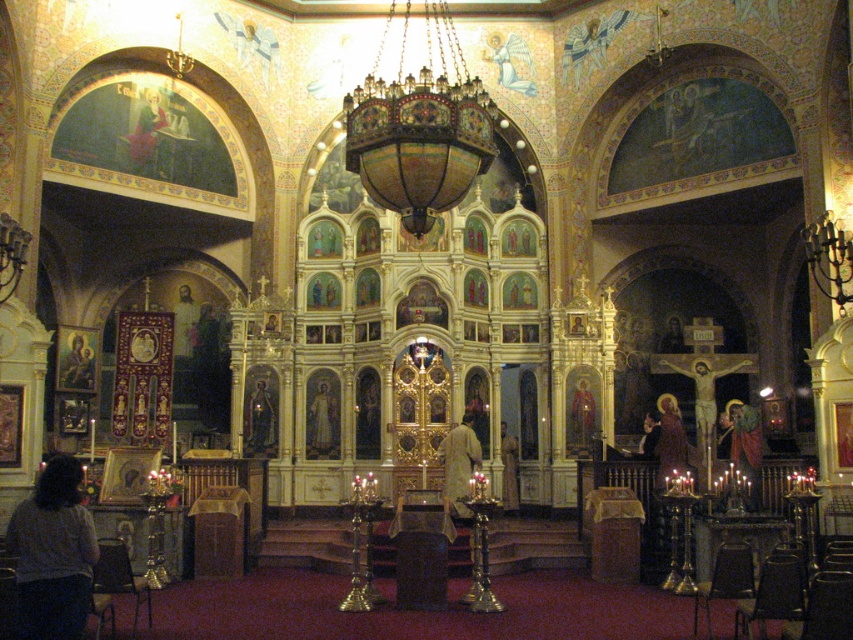
Can you confirm if gray sweater at lower left is smaller than gold textured robe at right?

Incorrect, gray sweater at lower left is not smaller in size than gold textured robe at right.

Locate an element on the screen. gray sweater at lower left is located at coordinates (53, 554).

Locate an element on the screen. gray sweater at lower left is located at coordinates (53, 554).

Which of these two, gray sweater at lower left or gold leaf icon at center, stands taller?

gray sweater at lower left is taller.

Can you confirm if gray sweater at lower left is positioned to the right of gold leaf icon at center?

No, gray sweater at lower left is not to the right of gold leaf icon at center.

Does point (44, 490) come behind point (260, 404)?

No.

At what (x,y) coordinates should I click in order to perform the action: click on gray sweater at lower left. Please return your answer as a coordinate pair (x, y). The image size is (853, 640). Looking at the image, I should click on (53, 554).

Who is more distant from viewer, (334, 416) or (752, 424)?

Positioned behind is point (334, 416).

Measure the distance between point (x=328, y=392) and camera.

Point (x=328, y=392) is 76.87 meters from camera.

Is point (326, 384) positioned behind point (747, 472)?

Yes, it is behind point (747, 472).

Locate an element on the screen. The width and height of the screenshot is (853, 640). gold mosaic icon at center is located at coordinates coord(322,417).